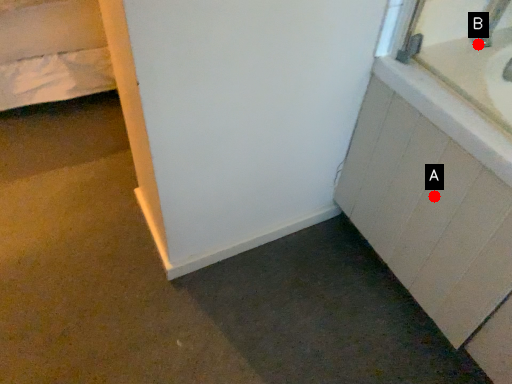
Question: Two points are circled on the image, labeled by A and B beside each circle. Which point is closer to the camera taking this photo?

Choices:
 (A) A is closer
 (B) B is closer

Answer: (A)